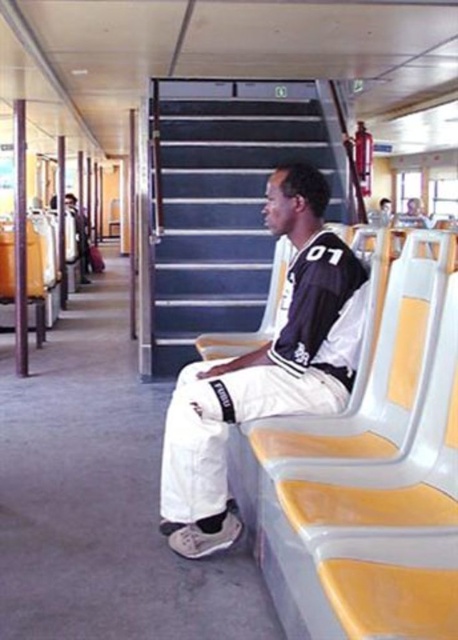
You are standing at the point labeled point [81,268] and want to walk to the point labeled point [315,304]. Based on the scene description, which direction should you move relative to your current position?

You should move forward because point [315,304] is in front of point [81,268].

You are a passenger on the ferry and you see the white matte pants at center and the matte black shirt at center. Which one is closer to you?

The white matte pants at center is closer to you because it is in front of the matte black shirt at center.